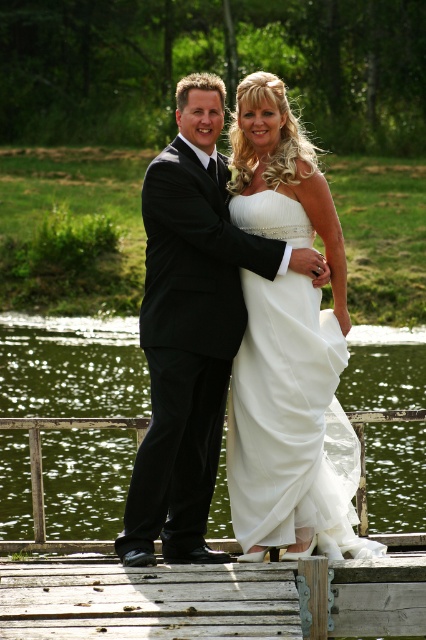
You are a photographer standing at the edge of the dock. You need to capture a photo that includes both the matte black suit at center and the green liquid water at center. Given that your camera has a maximum focus range of 12 meters, will you be able to include both subjects in the same frame without moving closer?

The matte black suit at center and green liquid water at center are 13.07 meters apart. Since the camera can only focus up to 12 meters, the distance between them exceeds the camera range. Therefore, you cannot capture both in the same frame without moving closer.

You are a photographer at a wedding and need to adjust the camera focus. The matte black suit at center and the white satin dress at center are both in the frame. Which one should you focus on first if you want to ensure the taller subject is in focus?

The white satin dress at center is taller than the matte black suit at center, so you should focus on the white satin dress at center first to ensure the taller subject is in focus.

You are a photographer planning to capture a wide shot of the couple standing on the dock. Given that the green liquid water at center is wider than the white satin dress at center, how does this spatial relationship affect your composition? Please explain your reasoning.

The green liquid water at center is wider than the white satin dress at center, so to ensure the dress remains the focal point while incorporating the expansive water, the photographer should position the couple centrally and use the water as a complementary backdrop. This maintains balance by emphasizing the dress while utilizing the wider water area for depth and context.